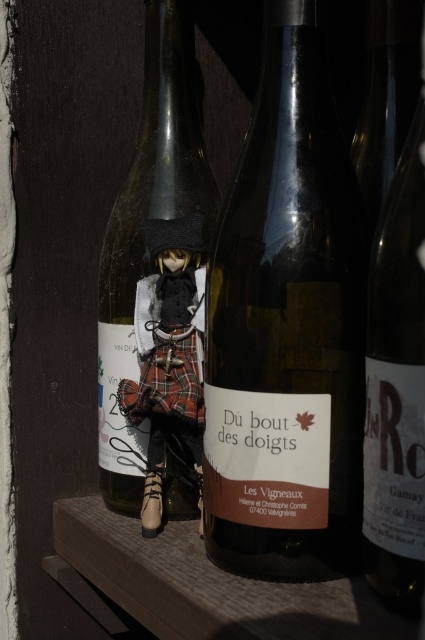
You are a delivery person who needs to place a new wine bottle that is 35 centimeters tall into the existing arrangement. Considering the space between the matte black wine at right and the viewer, will the new bottle fit without tilting it?

The space between the matte black wine at right and the viewer is 33.61 centimeters. Since the new bottle is 35 centimeters tall, it is slightly taller than the available space. Therefore, the new bottle will not fit without tilting it.

You are standing in front of the wine bottles and want to place a small gift between the two points marked as point (283, 260) and point (147, 509). Based on their positions, which point is closer to you?

Point (283, 260) is in front of point (147, 509), so it is closer to you.

You are organizing a wine display and need to place the matte black wine at right and the matte black doll at center. According to the scene, which object is placed above the other?

The matte black wine at right is positioned over the matte black doll at center, meaning the wine bottle is above the doll.